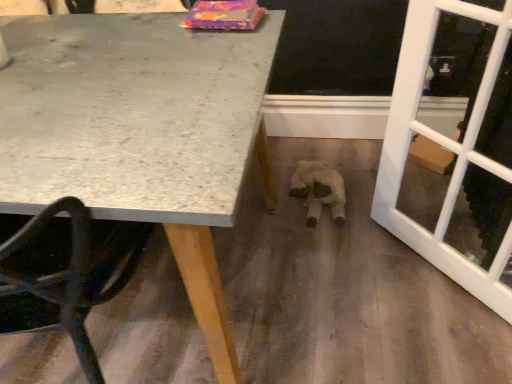
Locate an element on the screen. This screenshot has height=384, width=512. unoccupied space behind white plush toy at center is located at coordinates (312, 145).